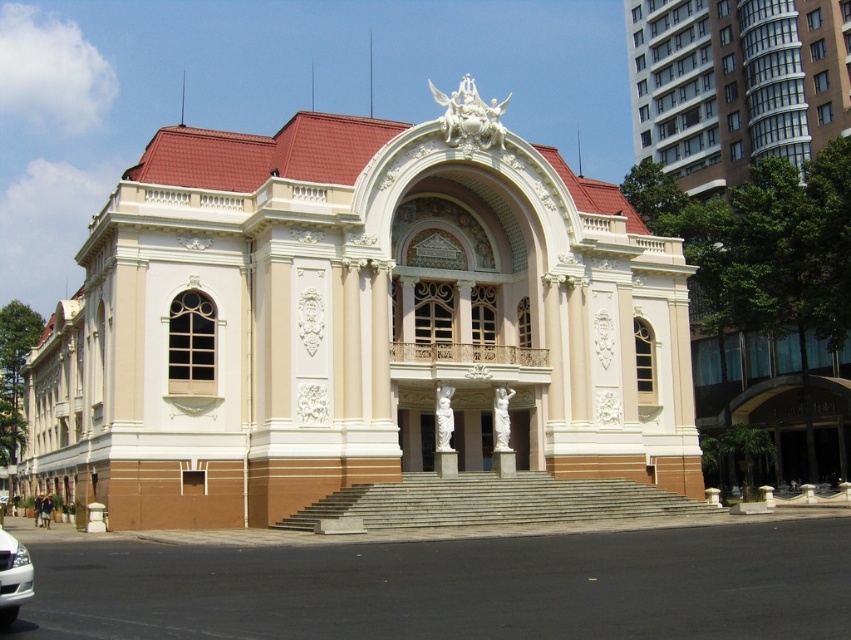
Question: Which point appears closest to the camera in this image?

Choices:
 (A) click(x=244, y=282)
 (B) click(x=6, y=561)

Answer: (B)

Question: Does beige stone palace at center have a smaller size compared to white glossy car at lower left?

Choices:
 (A) no
 (B) yes

Answer: (A)

Question: Among these objects, which one is farthest from the camera?

Choices:
 (A) white glossy car at lower left
 (B) beige stone palace at center

Answer: (B)

Question: Among these points, which one is farthest from the camera?

Choices:
 (A) tap(9, 564)
 (B) tap(363, 296)

Answer: (B)

Question: Where is beige stone palace at center located in relation to white glossy car at lower left in the image?

Choices:
 (A) above
 (B) below

Answer: (A)

Question: Does beige stone palace at center appear over white glossy car at lower left?

Choices:
 (A) no
 (B) yes

Answer: (B)